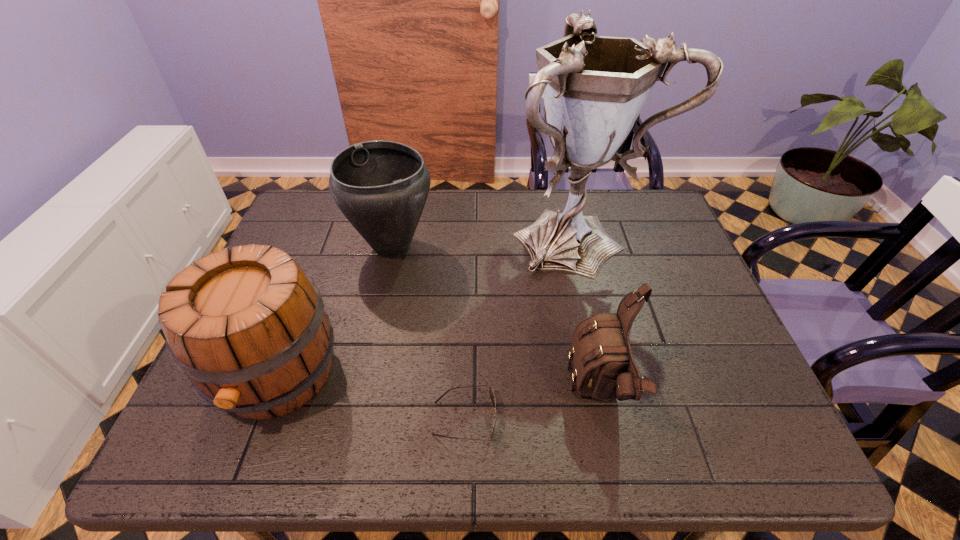
Find the location of a particular element. vacant area located 0.220m on the front-facing side of the shoulder bag is located at coordinates (467, 394).

Identify the location of vacant space located 0.140m on the front-facing side of the sunglasses. The image size is (960, 540). (564, 418).

Locate an element on the screen. This screenshot has height=540, width=960. trophy cup situated at the far edge is located at coordinates (594, 87).

Where is `urn at the far edge`? urn at the far edge is located at coordinates (381, 187).

Where is `cider present at the near edge`? cider present at the near edge is located at coordinates (248, 327).

Where is `shoulder bag located at the near edge`? The height and width of the screenshot is (540, 960). shoulder bag located at the near edge is located at coordinates (604, 368).

The image size is (960, 540). I want to click on sunglasses at the near edge, so click(x=492, y=397).

This screenshot has height=540, width=960. Identify the location of object that is at the left edge. (248, 327).

Where is `object that is at the right edge`? object that is at the right edge is located at coordinates (594, 87).

Where is `object at the near left corner`? The image size is (960, 540). object at the near left corner is located at coordinates (x=248, y=327).